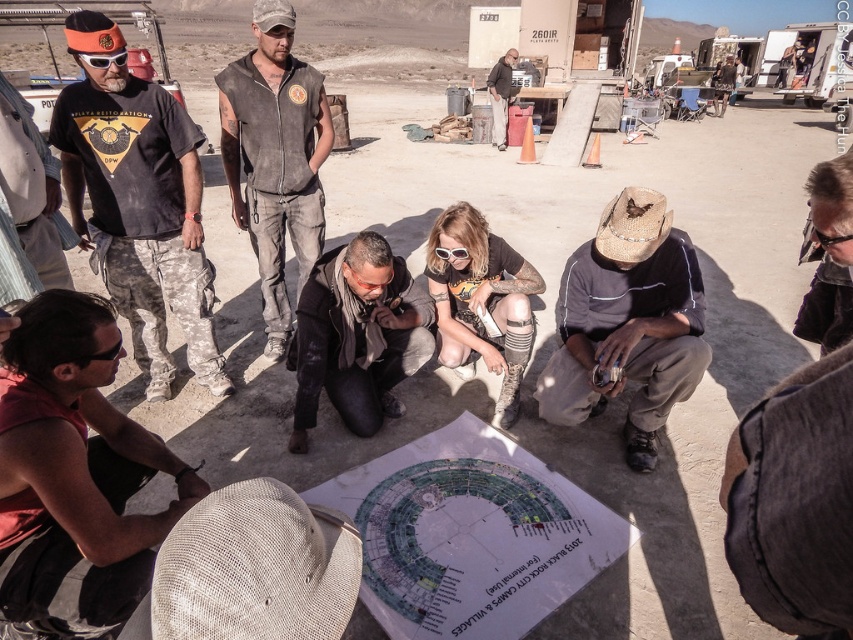
Who is positioned more to the left, reddish-brown fabric at lower left or black rubber goggles at lower right?

reddish-brown fabric at lower left

Can you confirm if reddish-brown fabric at lower left is wider than black rubber goggles at lower right?

Correct, the width of reddish-brown fabric at lower left exceeds that of black rubber goggles at lower right.

What are the coordinates of `reddish-brown fabric at lower left` in the screenshot? It's located at pyautogui.click(x=74, y=472).

Locate an element on the screen. reddish-brown fabric at lower left is located at coordinates (74, 472).

Between point (672, 324) and point (331, 403), which one is positioned in front?

Point (672, 324) is more forward.

You are a GUI agent. You are given a task and a screenshot of the screen. Output one action in this format:
    pyautogui.click(x=<x>, y=<y>)
    Task: Click on the brown straw hat at center
    This screenshot has width=853, height=640.
    Given the screenshot: What is the action you would take?
    pyautogui.click(x=627, y=323)

In order to click on brown straw hat at center in this screenshot , I will do pyautogui.click(x=627, y=323).

Which is more to the left, brown straw hat at center or distressed gray vest at center?

From the viewer's perspective, distressed gray vest at center appears more on the left side.

Based on the photo, can you confirm if brown straw hat at center is shorter than distressed gray vest at center?

Yes, brown straw hat at center is shorter than distressed gray vest at center.

Is point (666, 320) less distant than point (280, 0)?

Yes, it is.

Where is `brown straw hat at center`? The height and width of the screenshot is (640, 853). brown straw hat at center is located at coordinates (627, 323).